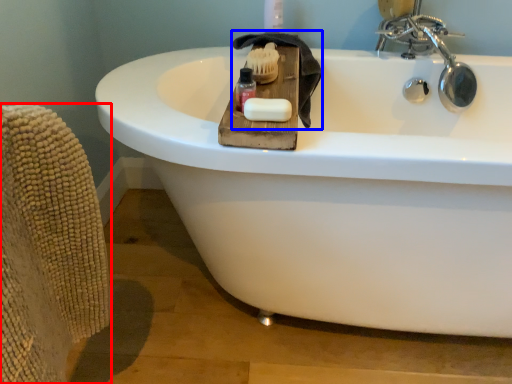
Question: Among these objects, which one is nearest to the camera, armchair (highlighted by a red box) or bath towel (highlighted by a blue box)?

Choices:
 (A) armchair
 (B) bath towel

Answer: (A)